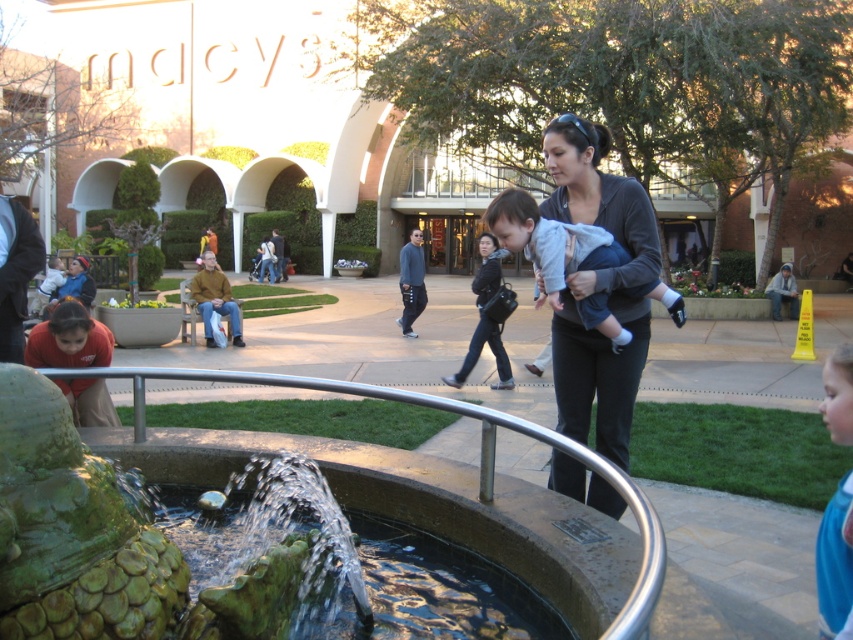
Question: Is matte stone fountain at center below dark gray sweater at center?

Choices:
 (A) yes
 (B) no

Answer: (B)

Question: Which of the following is the farthest from the observer?

Choices:
 (A) light gray fleece at center
 (B) matte stone fountain at center

Answer: (B)

Question: From the image, what is the correct spatial relationship of light gray fleece at center in relation to matte black jacket at center?

Choices:
 (A) right
 (B) left

Answer: (A)

Question: Which of the following is the farthest from the observer?

Choices:
 (A) dark gray sweater at center
 (B) blue jersey at lower right

Answer: (A)

Question: Is light gray fleece at center below matte black jacket at center?

Choices:
 (A) no
 (B) yes

Answer: (B)

Question: Among these points, which one is nearest to the camera?

Choices:
 (A) (851, 605)
 (B) (346, 42)
 (C) (567, 147)
 (D) (492, 259)

Answer: (A)